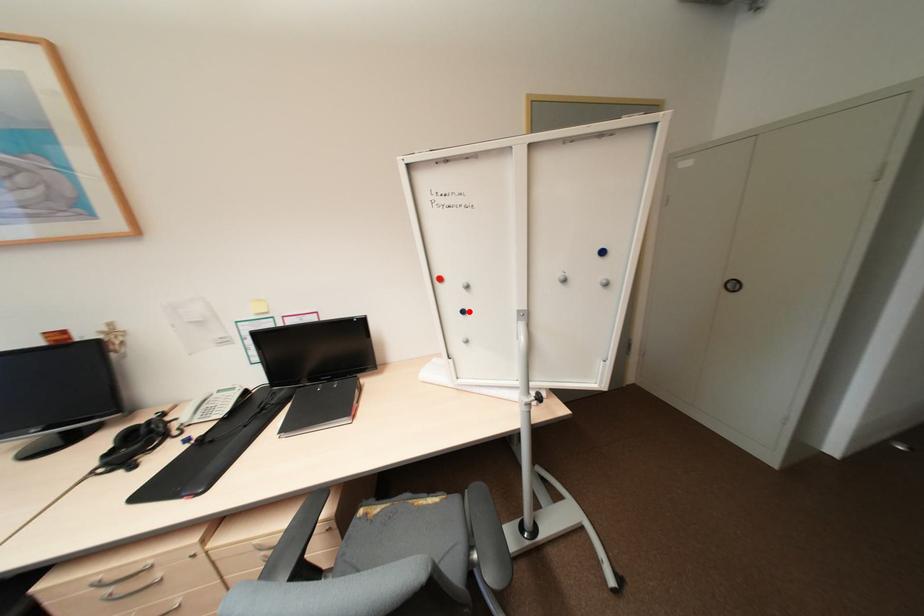
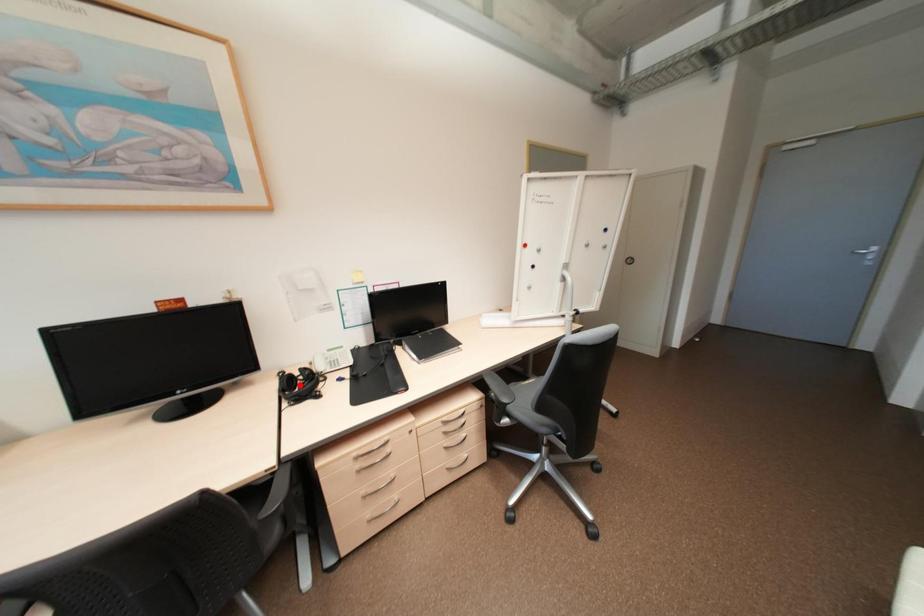
I am providing you with two images of the same scene from different viewpoints. A red point is marked on the first image and another point is marked on the second image. Is the marked point in image1 the same physical position as the marked point in image2?

No